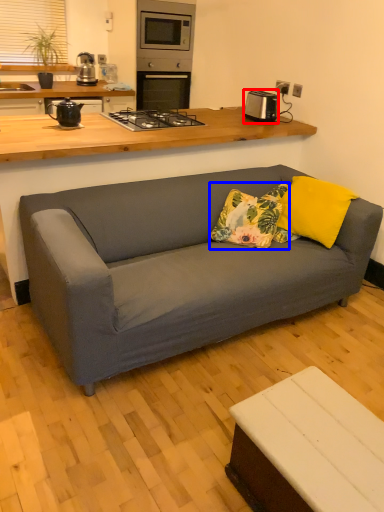
Question: Which of the following is the farthest to the observer, appliance (highlighted by a red box) or throw pillow (highlighted by a blue box)?

Choices:
 (A) appliance
 (B) throw pillow

Answer: (A)